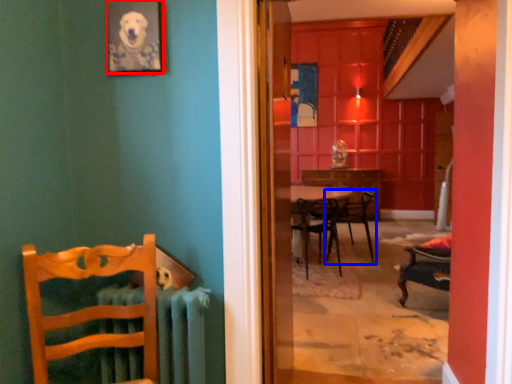
Question: Which point is closer to the camera, picture frame (highlighted by a red box) or chair (highlighted by a blue box)?

Choices:
 (A) picture frame
 (B) chair

Answer: (A)